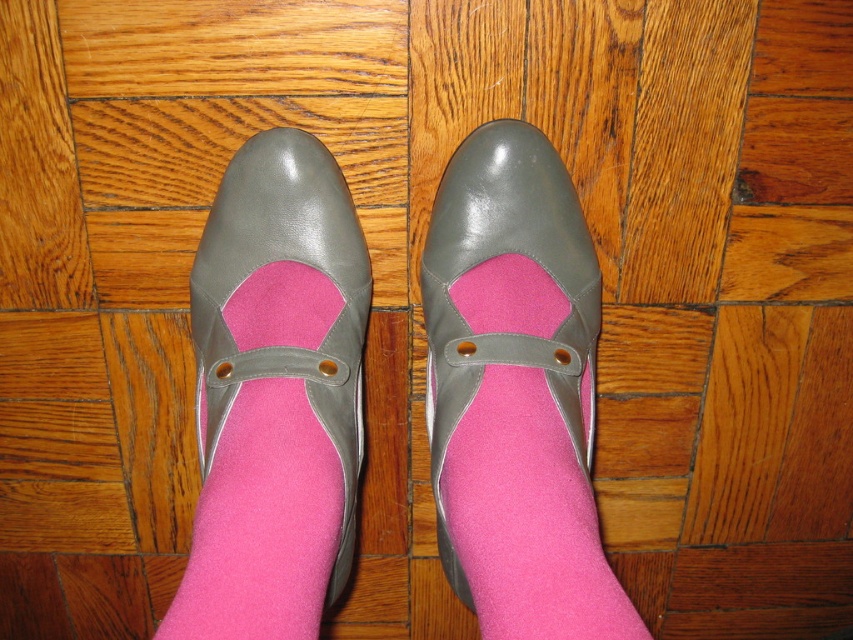
You are standing in front of two gray shoes on a wooden floor. You notice the matte gray sandal at center and the matte gray shoe at center. Which one appears nearer to you?

The matte gray sandal at center appears nearer to you because it is closer to the viewer than the matte gray shoe at center.

You are trying to decide between the matte gray sandal at center and the matte gray shoe at center for a low key event. Which one has a higher heel?

The matte gray sandal at center has a greater height compared to the matte gray shoe at center, so it has a higher heel.